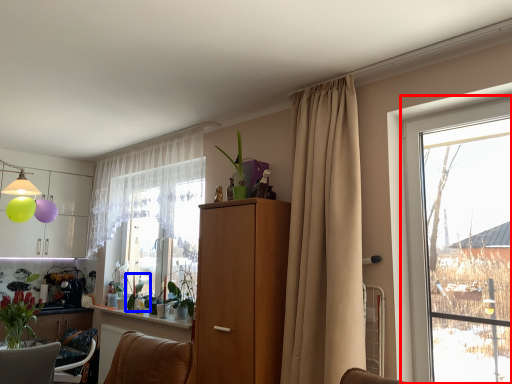
Question: Which point is further to the camera, window (highlighted by a red box) or plant (highlighted by a blue box)?

Choices:
 (A) window
 (B) plant

Answer: (B)